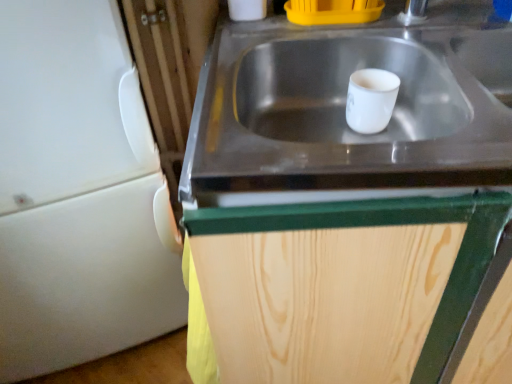
Question: Is wooden cabinet at center to the left of white matte refrigerator at left from the viewer's perspective?

Choices:
 (A) no
 (B) yes

Answer: (A)

Question: Is wooden cabinet at center facing towards white matte refrigerator at left?

Choices:
 (A) yes
 (B) no

Answer: (B)

Question: Is wooden cabinet at center taller than white matte refrigerator at left?

Choices:
 (A) yes
 (B) no

Answer: (B)

Question: Is the depth of wooden cabinet at center less than that of white matte refrigerator at left?

Choices:
 (A) no
 (B) yes

Answer: (B)

Question: Considering the relative sizes of wooden cabinet at center and white matte refrigerator at left in the image provided, is wooden cabinet at center smaller than white matte refrigerator at left?

Choices:
 (A) no
 (B) yes

Answer: (A)

Question: Is wooden cabinet at center next to white matte refrigerator at left and touching it?

Choices:
 (A) yes
 (B) no

Answer: (B)

Question: Could you tell me if stainless steel sink at center is turned towards white glossy mug at center?

Choices:
 (A) no
 (B) yes

Answer: (B)

Question: Is stainless steel sink at center positioned in front of white glossy mug at center?

Choices:
 (A) no
 (B) yes

Answer: (B)

Question: Is white glossy mug at center located within stainless steel sink at center?

Choices:
 (A) no
 (B) yes

Answer: (B)

Question: Is the position of stainless steel sink at center more distant than that of white glossy mug at center?

Choices:
 (A) no
 (B) yes

Answer: (A)

Question: Are stainless steel sink at center and white glossy mug at center located far from each other?

Choices:
 (A) yes
 (B) no

Answer: (B)

Question: Is stainless steel sink at center placed right next to white glossy mug at center?

Choices:
 (A) yes
 (B) no

Answer: (B)

Question: From the image's perspective, is white matte refrigerator at left under stainless steel sink at center?

Choices:
 (A) yes
 (B) no

Answer: (A)